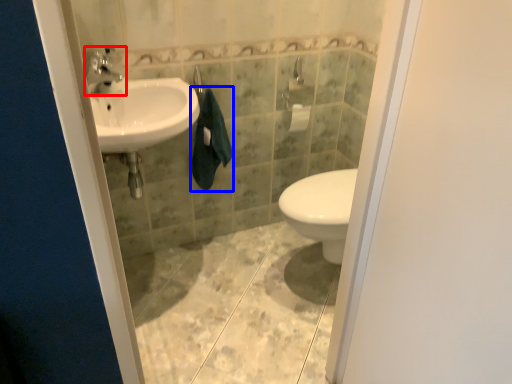
Question: Which point is closer to the camera, tap (highlighted by a red box) or bath towel (highlighted by a blue box)?

Choices:
 (A) tap
 (B) bath towel

Answer: (A)